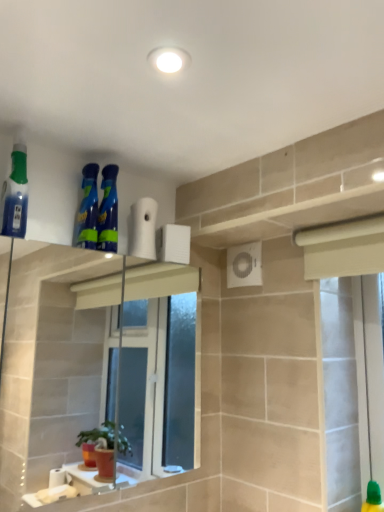
Question: Considering the relative sizes of translucent blue spray bottle at left, the 1th cleaning product in the left-to-right sequence, and white matte toilet paper at upper center in the image provided, is translucent blue spray bottle at left, the 1th cleaning product in the left-to-right sequence, thinner than white matte toilet paper at upper center?

Choices:
 (A) yes
 (B) no

Answer: (B)

Question: Is translucent blue spray bottle at left, the 1th cleaning product in the left-to-right sequence, bigger than white matte toilet paper at upper center?

Choices:
 (A) no
 (B) yes

Answer: (B)

Question: Are translucent blue spray bottle at left, the 1th cleaning product in the left-to-right sequence, and white matte toilet paper at upper center located far from each other?

Choices:
 (A) no
 (B) yes

Answer: (A)

Question: Is translucent blue spray bottle at left, the 1th cleaning product in the left-to-right sequence, outside of white matte toilet paper at upper center?

Choices:
 (A) yes
 (B) no

Answer: (A)

Question: From a real-world perspective, is translucent blue spray bottle at left, the 1th cleaning product in the left-to-right sequence, over white matte toilet paper at upper center?

Choices:
 (A) yes
 (B) no

Answer: (A)

Question: Is point (91, 169) closer or farther from the camera than point (14, 216)?

Choices:
 (A) farther
 (B) closer

Answer: (A)

Question: Choose the correct answer: Is blue glossy spray bottles at upper center, the second cleaning product viewed from the right, inside translucent blue spray bottle at left, the 1th cleaning product in the left-to-right sequence, or outside it?

Choices:
 (A) outside
 (B) inside

Answer: (A)

Question: In terms of height, does blue glossy spray bottles at upper center, the second cleaning product positioned from the left, look taller or shorter compared to translucent blue spray bottle at left, which appears as the third cleaning product when viewed from the right?

Choices:
 (A) short
 (B) tall

Answer: (A)

Question: From a real-world perspective, is blue glossy spray bottles at upper center, the second cleaning product positioned from the left, physically located above or below translucent blue spray bottle at left, which appears as the third cleaning product when viewed from the right?

Choices:
 (A) above
 (B) below

Answer: (B)

Question: In terms of height, does blue glossy spray bottles at upper center, which appears as the 1th cleaning product when viewed from the right, look taller or shorter compared to translucent blue spray bottle at left, the 1th cleaning product in the left-to-right sequence?

Choices:
 (A) tall
 (B) short

Answer: (B)

Question: In the image, is blue glossy spray bottles at upper center, acting as the 3th cleaning product starting from the left, positioned in front of or behind translucent blue spray bottle at left, the 1th cleaning product in the left-to-right sequence?

Choices:
 (A) behind
 (B) front

Answer: (A)

Question: From a real-world perspective, relative to translucent blue spray bottle at left, the 1th cleaning product in the left-to-right sequence, is blue glossy spray bottles at upper center, acting as the 3th cleaning product starting from the left, vertically above or below?

Choices:
 (A) above
 (B) below

Answer: (B)

Question: Is blue glossy spray bottles at upper center, which appears as the 1th cleaning product when viewed from the right, inside or outside of translucent blue spray bottle at left, which appears as the third cleaning product when viewed from the right?

Choices:
 (A) inside
 (B) outside

Answer: (B)

Question: Which is correct: translucent blue spray bottle at left, which appears as the third cleaning product when viewed from the right, is inside blue glossy spray bottles at upper center, which appears as the 1th cleaning product when viewed from the right, or outside of it?

Choices:
 (A) inside
 (B) outside

Answer: (B)

Question: In the image, is translucent blue spray bottle at left, which appears as the third cleaning product when viewed from the right, on the left side or the right side of blue glossy spray bottles at upper center, which appears as the 1th cleaning product when viewed from the right?

Choices:
 (A) right
 (B) left

Answer: (B)